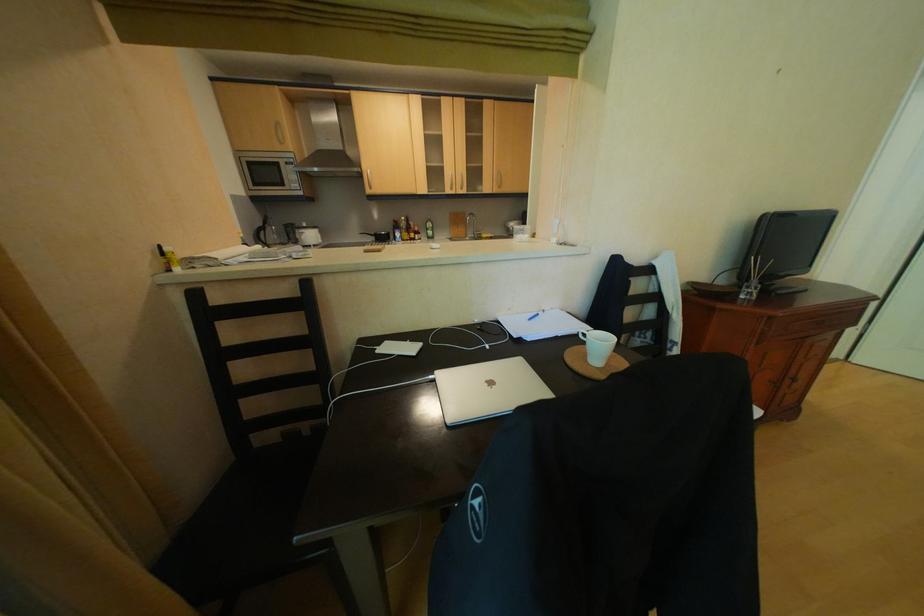
Find where to sit the chair sitting surface. Please return your answer as a coordinate pair (x, y).

(263, 493)